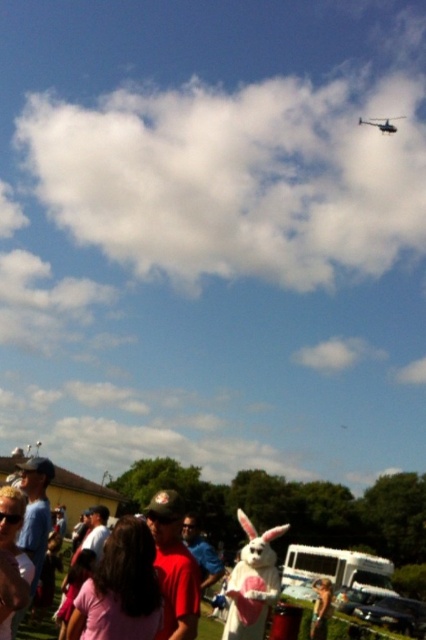
You are planning to take a photo of the white plush rabbit at center and the metallic silver helicopter at upper right. Considering their sizes, which object should you focus on first to ensure both are in frame without needing to zoom in or out?

The white plush rabbit at center is smaller than the metallic silver helicopter at upper right. To ensure both are in frame without zooming, focus on the smaller object first, which is the white plush rabbit at center, then adjust to include the larger helicopter.

You are planning to take a photo of the white plush rabbit at center and the metallic silver helicopter at upper right. Since the helicopter is higher up, will the rabbit be visible in the photo if you focus on the helicopter?

The white plush rabbit at center is not as tall as the metallic silver helicopter at upper right, so if you focus on the helicopter, the rabbit might still be visible in the foreground depending on the camera angle and zoom level.

Based on the photo, you are a photographer trying to capture a photo of the white plush rabbit at center and the metallic silver helicopter at upper right. To ensure both are in frame, where should you position the rabbit relative to the helicopter?

The white plush rabbit at center should be positioned to the left of the metallic silver helicopter at upper right to ensure both are in frame.